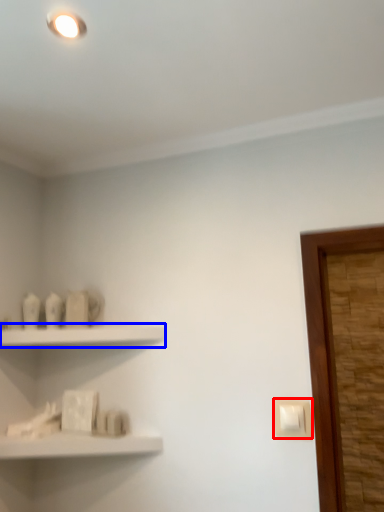
Question: Which object appears closest to the camera in this image, light switch (highlighted by a red box) or shelf (highlighted by a blue box)?

Choices:
 (A) light switch
 (B) shelf

Answer: (A)